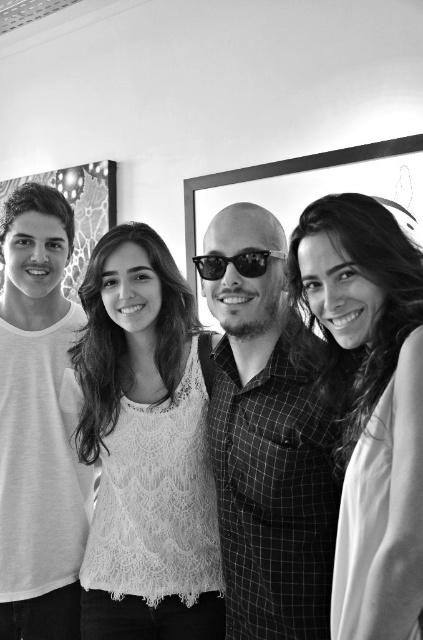
You are a photographer adjusting your camera to focus on two specific points in the image. The first point is at coordinate point (308, 465) and the second is at point (373, 337). Which point should you focus on first if you want to capture the closest object to the camera?

Point (308, 465) is further to the camera than point (373, 337), so you should focus on point (308, 465) first as it is closer to the camera.

From the picture: You are standing in the room and want to touch the lace fabric top at center. Which direction should you move from your current position at point (145, 449)?

Since the point (145, 449) corresponds to the lace fabric top at center, you are already at the correct location to touch it.

You are a photographer trying to capture a clear shot of both the lace fabric top at center and the white lace top at center. Which one will appear closer in the photo?

The lace fabric top at center will appear closer in the photo because it is positioned closer to the viewer than the white lace top at center.